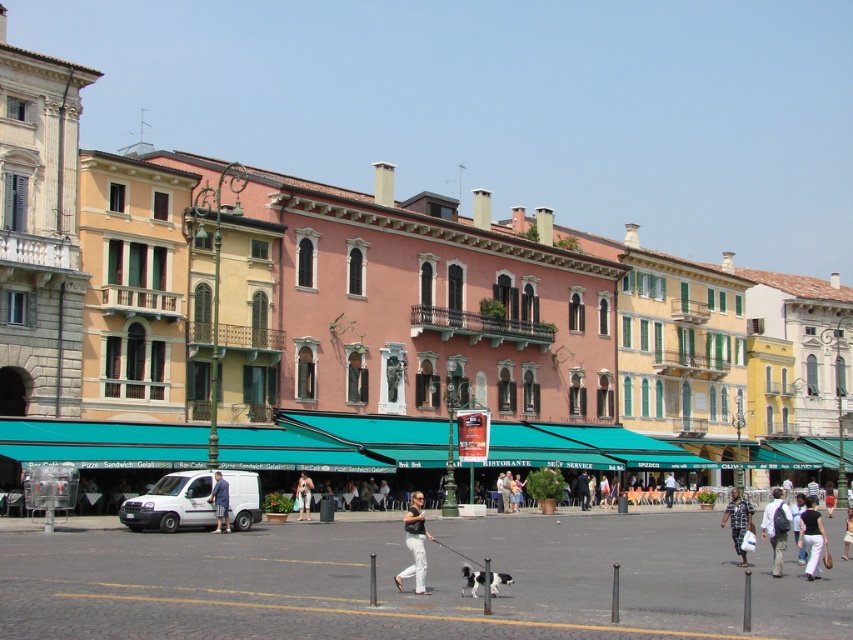
You are standing in the square and want to take a photo of the point at coordinates (779, 525). If your camera has a maximum focus range of 135 feet, will you be able to capture it clearly?

The distance of point (779, 525) from viewer is 136.48 feet, which exceeds the camera maximum focus range of 135 feet. So you won not be able to capture it clearly.

You are standing in the square and want to walk towards the two points marked in the image. Which point, point (421, 502) or point (308, 500), is closer to you?

Point (421, 502) is closer to the viewer than point (308, 500).